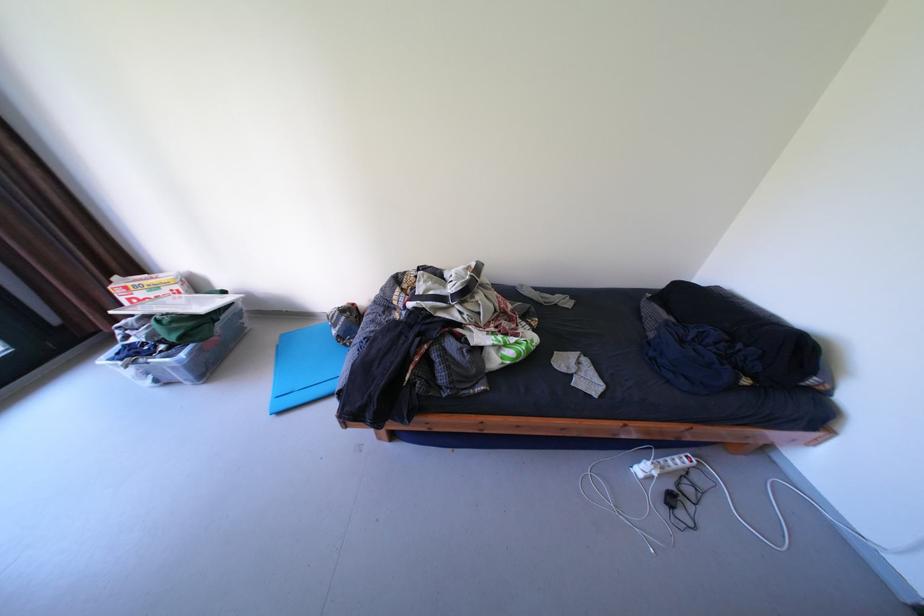
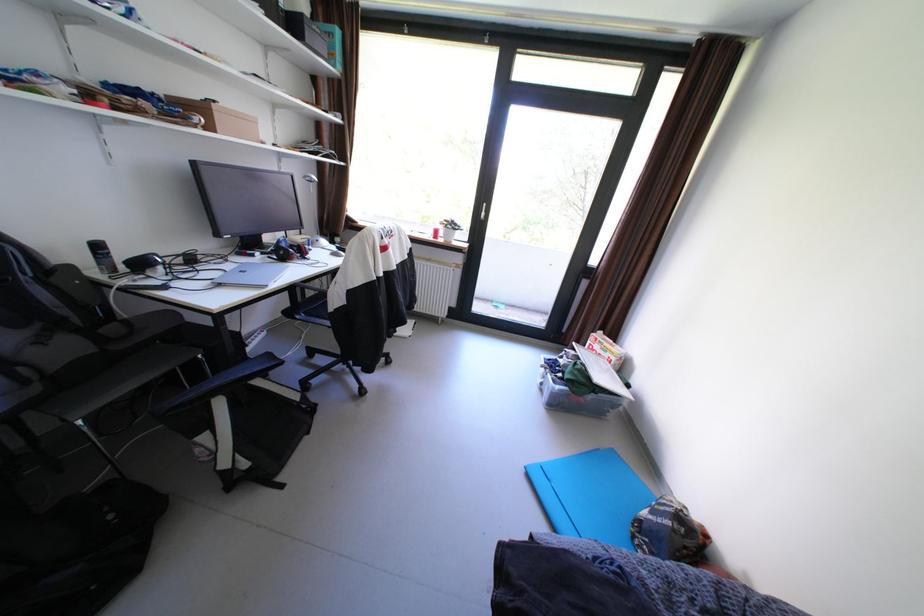
Find the pixel in the second image that matches point (144, 341) in the first image.

(572, 361)